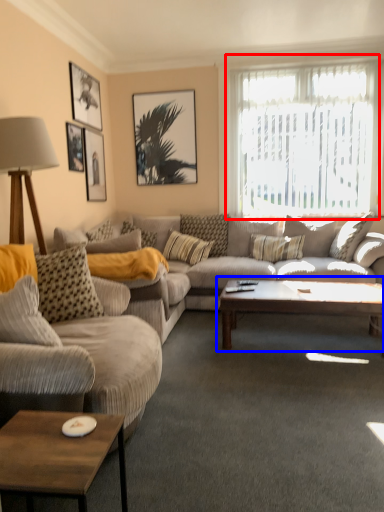
Question: Which object is closer to the camera taking this photo, window (highlighted by a red box) or coffee table (highlighted by a blue box)?

Choices:
 (A) window
 (B) coffee table

Answer: (B)